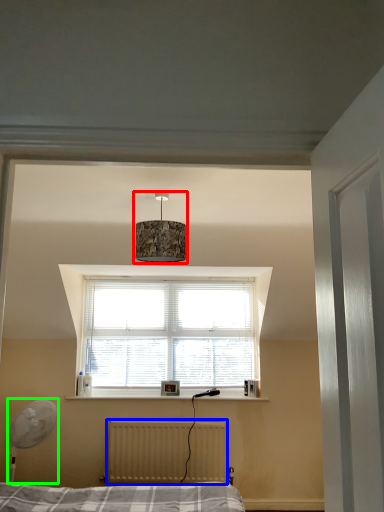
Question: Which object is positioned farthest from lamp (highlighted by a red box)? Select from radiator (highlighted by a blue box) and table lamp (highlighted by a green box).

Choices:
 (A) radiator
 (B) table lamp

Answer: (A)